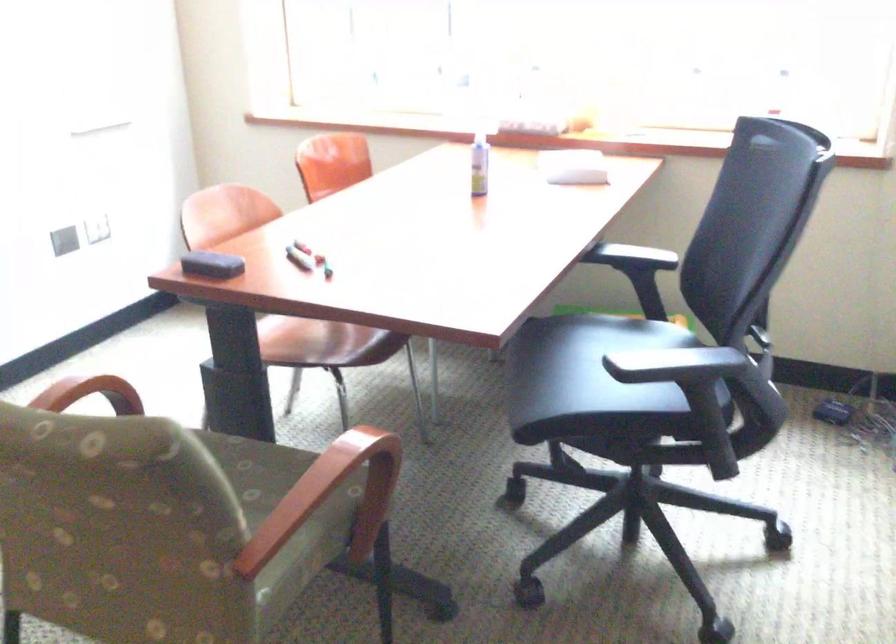
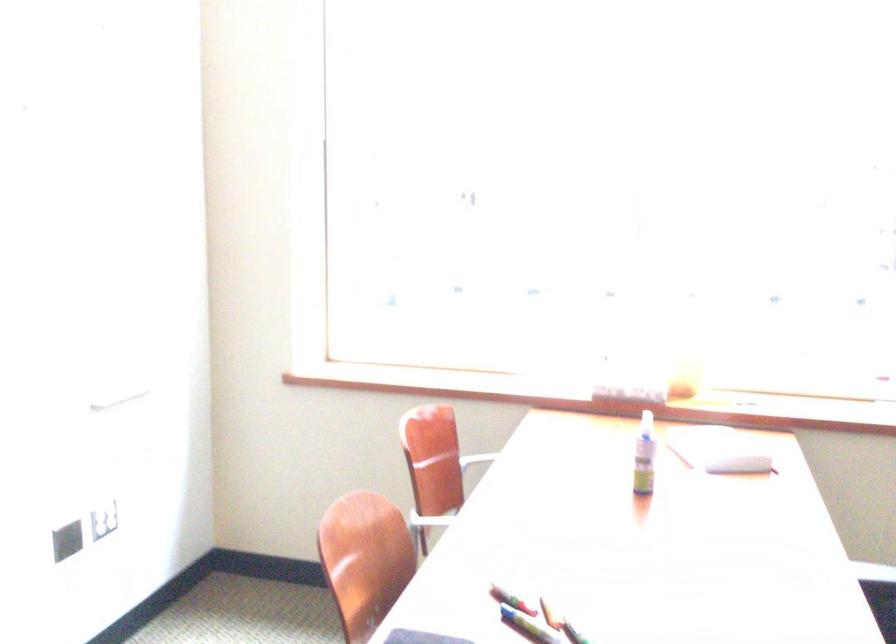
The images are taken continuously from a first-person perspective. In which direction are you moving?

The movement direction of the cameraman is left, forward.